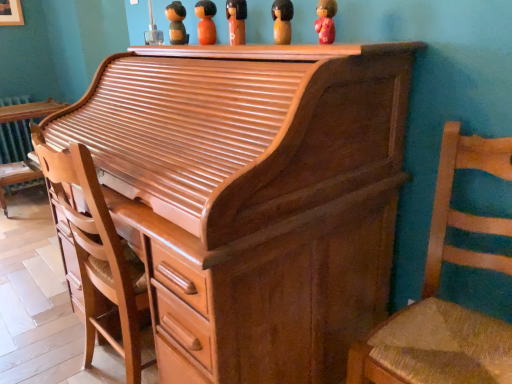
What are the coordinates of `free point in front of matte orange doll at upper center, which is the third toy from left to right` in the screenshot? It's located at (232, 46).